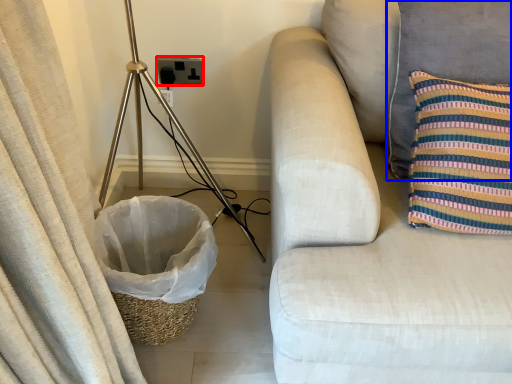
Question: Among these objects, which one is farthest to the camera, electric outlet (highlighted by a red box) or pillow (highlighted by a blue box)?

Choices:
 (A) electric outlet
 (B) pillow

Answer: (A)